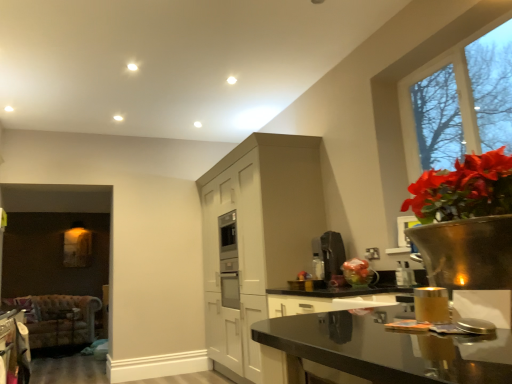
Question: From a real-world perspective, is gold metallic candle holder at lower right under satin silver coffee maker at upper right, the second appliance positioned from the back?

Choices:
 (A) yes
 (B) no

Answer: (A)

Question: From a real-world perspective, is gold metallic candle holder at lower right positioned over satin silver coffee maker at upper right, marked as the 2th appliance in a left-to-right arrangement, based on gravity?

Choices:
 (A) yes
 (B) no

Answer: (B)

Question: Is the position of gold metallic candle holder at lower right more distant than that of satin silver coffee maker at upper right, which is the 1th appliance in right-to-left order?

Choices:
 (A) no
 (B) yes

Answer: (A)

Question: From the image's perspective, is gold metallic candle holder at lower right over satin silver coffee maker at upper right, acting as the first appliance starting from the front?

Choices:
 (A) yes
 (B) no

Answer: (A)

Question: Is gold metallic candle holder at lower right thinner than satin silver coffee maker at upper right, marked as the 2th appliance in a left-to-right arrangement?

Choices:
 (A) yes
 (B) no

Answer: (B)

Question: Would you say gold metallic candle holder at lower right is a long distance from satin silver coffee maker at upper right, which is the 1th appliance in right-to-left order?

Choices:
 (A) yes
 (B) no

Answer: (A)

Question: Does white matte cabinetry at center have a greater height compared to satin silver coffee maker at upper right, marked as the 2th appliance in a left-to-right arrangement?

Choices:
 (A) yes
 (B) no

Answer: (A)

Question: From the image's perspective, is white matte cabinetry at center located above satin silver coffee maker at upper right, which is the 1th appliance in right-to-left order?

Choices:
 (A) yes
 (B) no

Answer: (B)

Question: Is white matte cabinetry at center not near satin silver coffee maker at upper right, the second appliance positioned from the back?

Choices:
 (A) yes
 (B) no

Answer: (A)

Question: From a real-world perspective, is white matte cabinetry at center positioned under satin silver coffee maker at upper right, marked as the 2th appliance in a left-to-right arrangement, based on gravity?

Choices:
 (A) no
 (B) yes

Answer: (A)

Question: Can you confirm if white matte cabinetry at center is positioned to the right of satin silver coffee maker at upper right, which is the 1th appliance in right-to-left order?

Choices:
 (A) yes
 (B) no

Answer: (B)

Question: Does white matte cabinetry at center have a larger size compared to satin silver coffee maker at upper right, the second appliance positioned from the back?

Choices:
 (A) yes
 (B) no

Answer: (A)

Question: Considering the relative sizes of clear glass window at upper right and black glossy countertop at lower right in the image provided, is clear glass window at upper right bigger than black glossy countertop at lower right?

Choices:
 (A) yes
 (B) no

Answer: (B)